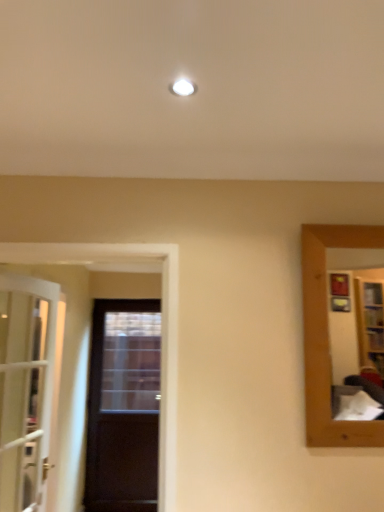
Question: In terms of height, does dark wood door at center, the 1th door when ordered from back to front, look taller or shorter compared to white glass door at left, the first door when ordered from front to back?

Choices:
 (A) short
 (B) tall

Answer: (B)

Question: Looking at their shapes, would you say dark wood door at center, which appears as the second door when viewed from the front, is wider or thinner than white glass door at left, which ranks as the 2th door in right-to-left order?

Choices:
 (A) wide
 (B) thin

Answer: (B)

Question: From the image's perspective, is dark wood door at center, which appears as the first door when viewed from the right, above or below white glass door at left, which is the second door from back to front?

Choices:
 (A) above
 (B) below

Answer: (B)

Question: Is point (19, 481) closer or farther from the camera than point (142, 307)?

Choices:
 (A) farther
 (B) closer

Answer: (B)

Question: In terms of height, does white glass door at left, which ranks as the 2th door in right-to-left order, look taller or shorter compared to dark wood door at center, which is the 2th door from left to right?

Choices:
 (A) tall
 (B) short

Answer: (B)

Question: From the image's perspective, is white glass door at left, which is the second door from back to front, positioned above or below dark wood door at center, which appears as the first door when viewed from the right?

Choices:
 (A) below
 (B) above

Answer: (B)

Question: Visually, is white glass door at left, which is the 1th door from left to right, positioned to the left or to the right of dark wood door at center, the 1th door when ordered from back to front?

Choices:
 (A) right
 (B) left

Answer: (B)